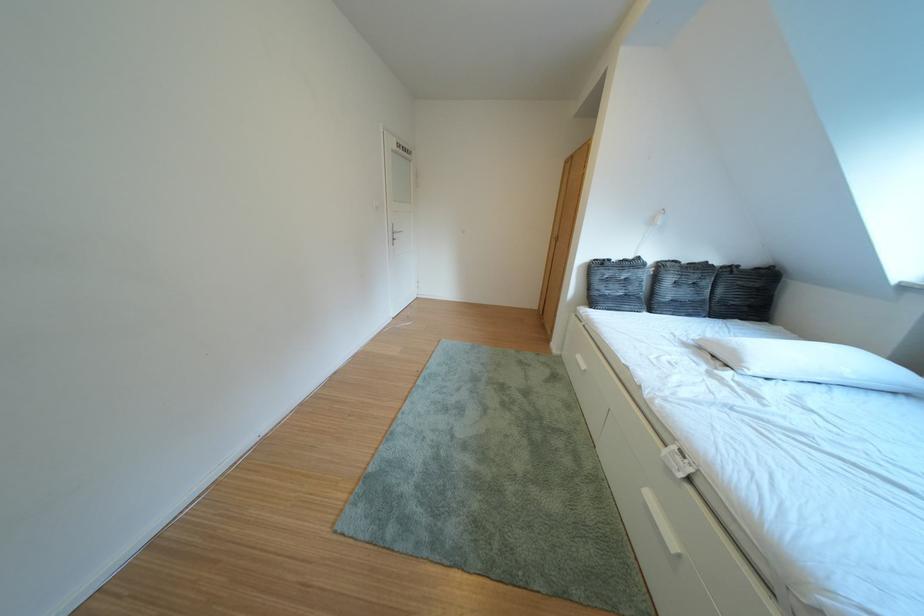
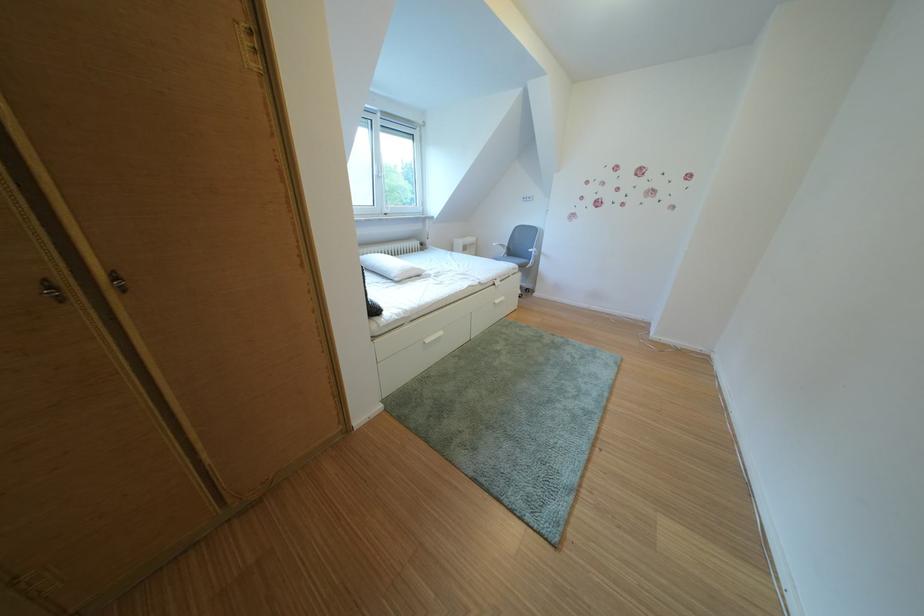
Where in the second image is the point corresponding to [662,500] from the first image?

(511, 307)